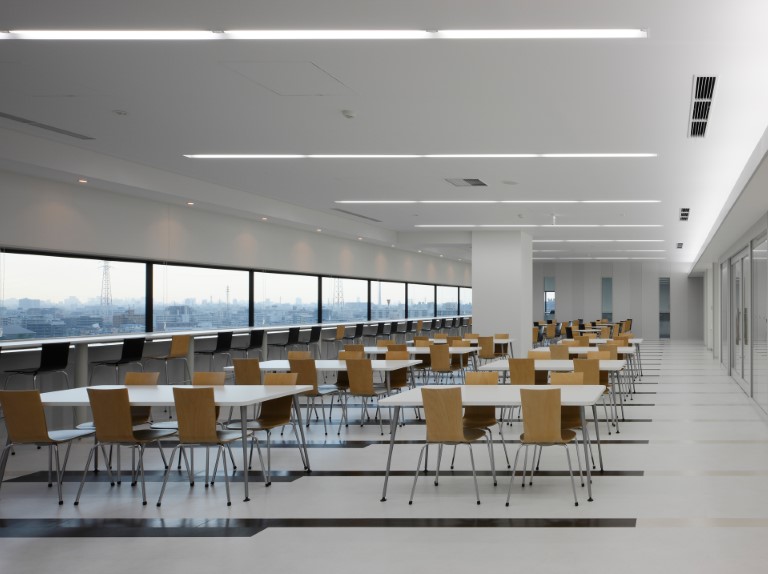
At what (x,y) coordinates should I click in order to perform the action: click on lights. Please return your answer as a coordinate pair (x, y). Looking at the image, I should click on (627, 38), (643, 166), (659, 209), (664, 235), (667, 244), (663, 261).